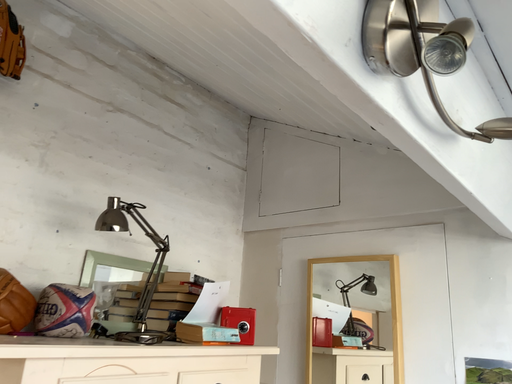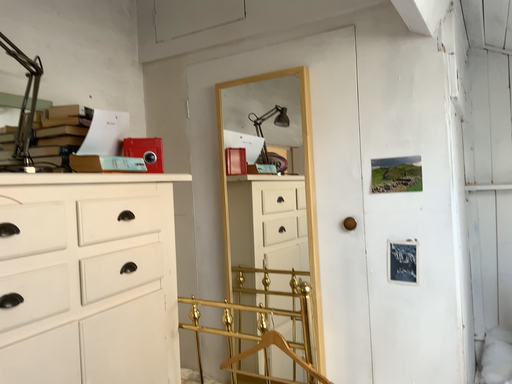
Question: How did the camera likely rotate when shooting the video?

Choices:
 (A) rotated left
 (B) rotated right

Answer: (B)